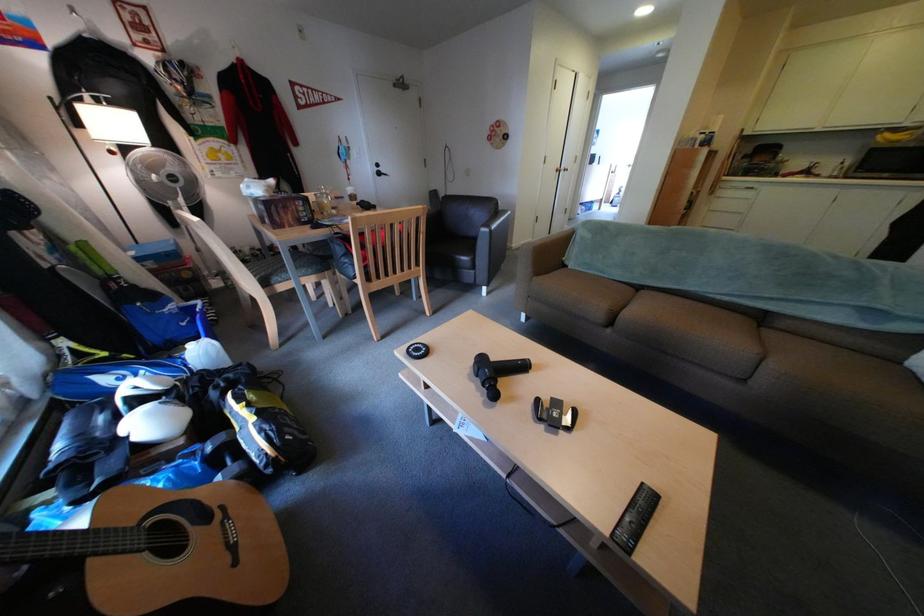
Locate an element on the screen. brass door knob is located at coordinates point(565,169).